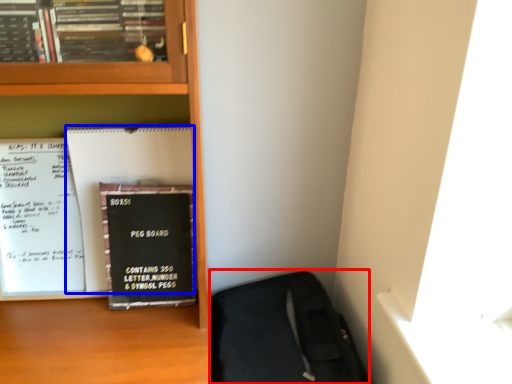
Question: Which object is closer to the camera taking this photo, sleeping bag (highlighted by a red box) or paperback book (highlighted by a blue box)?

Choices:
 (A) sleeping bag
 (B) paperback book

Answer: (A)